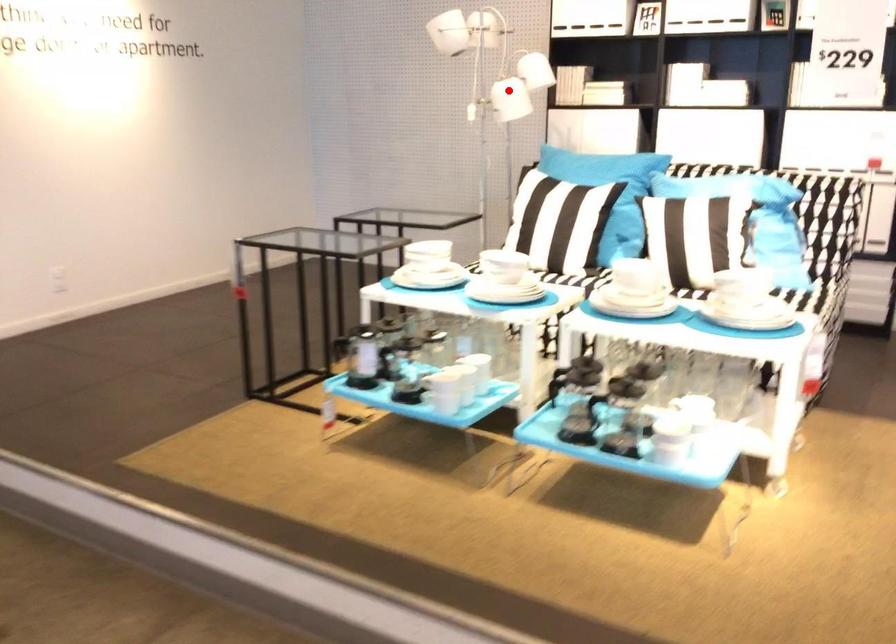
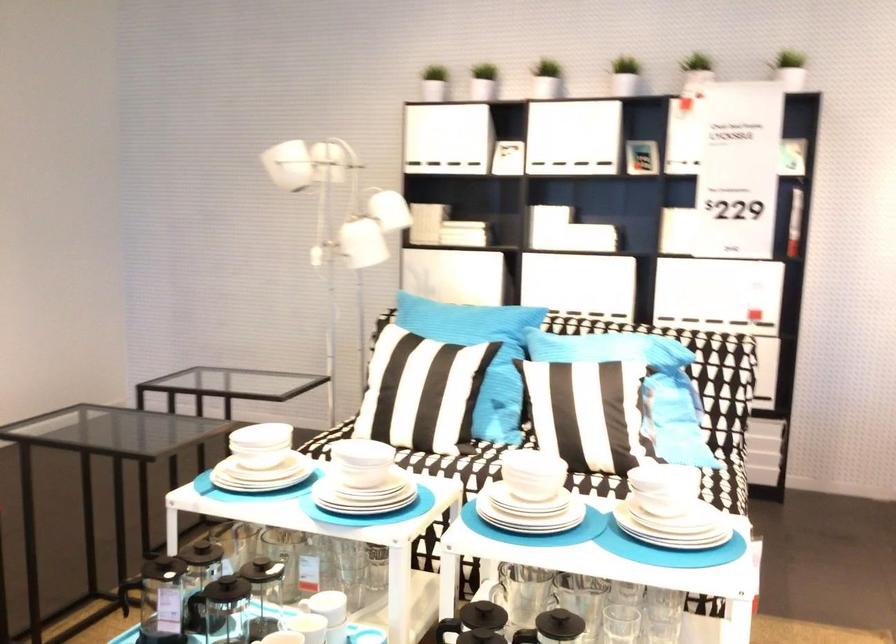
Locate, in the second image, the point that corresponds to the highlighted location in the first image.

(362, 243)